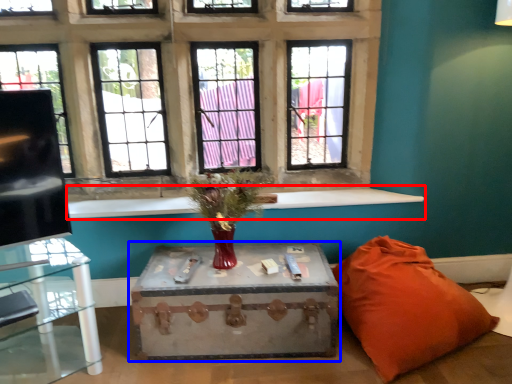
Question: Which point is closer to the camera, window sill (highlighted by a red box) or table (highlighted by a blue box)?

Choices:
 (A) window sill
 (B) table

Answer: (B)